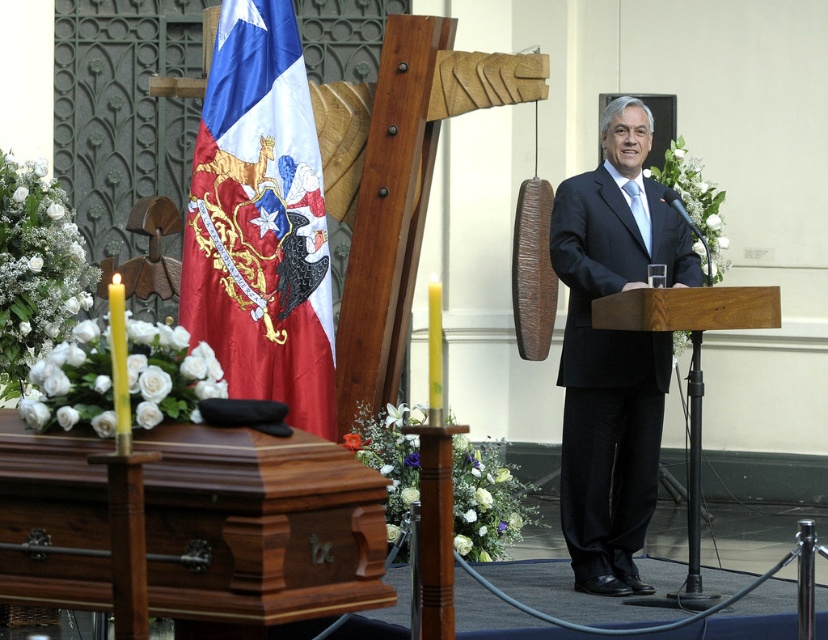
You are standing at the center of the stage facing the casket. Where is the satin flag at left located relative to your position?

The satin flag at left is located to your left side, at coordinates approximately 0.345 on the x axis and 0.315 on the y axis relative to the stage.